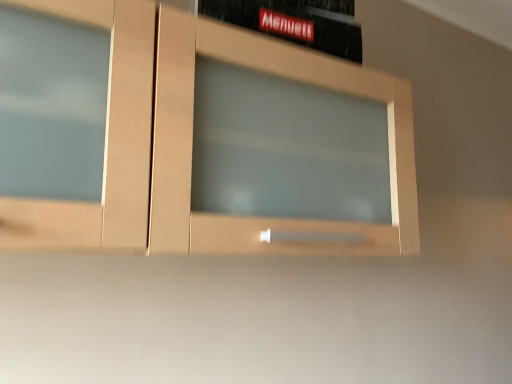
What is the approximate width of matte glass window at center?

matte glass window at center is 11.18 inches wide.

Locate an element on the screen. This screenshot has width=512, height=384. matte glass window at center is located at coordinates (192, 140).

Describe the element at coordinates (192, 140) in the screenshot. I see `matte glass window at center` at that location.

Locate an element on the screen. matte glass window at center is located at coordinates (192, 140).